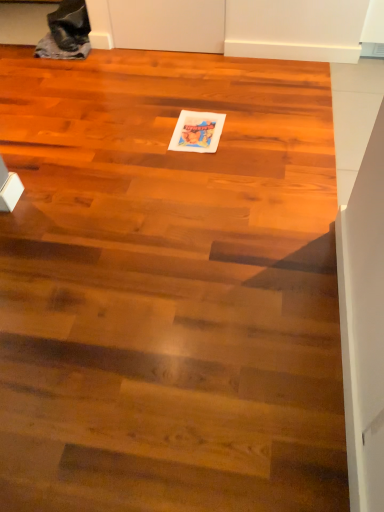
In order to click on vacant space behind white paper at center in this screenshot , I will do `click(194, 101)`.